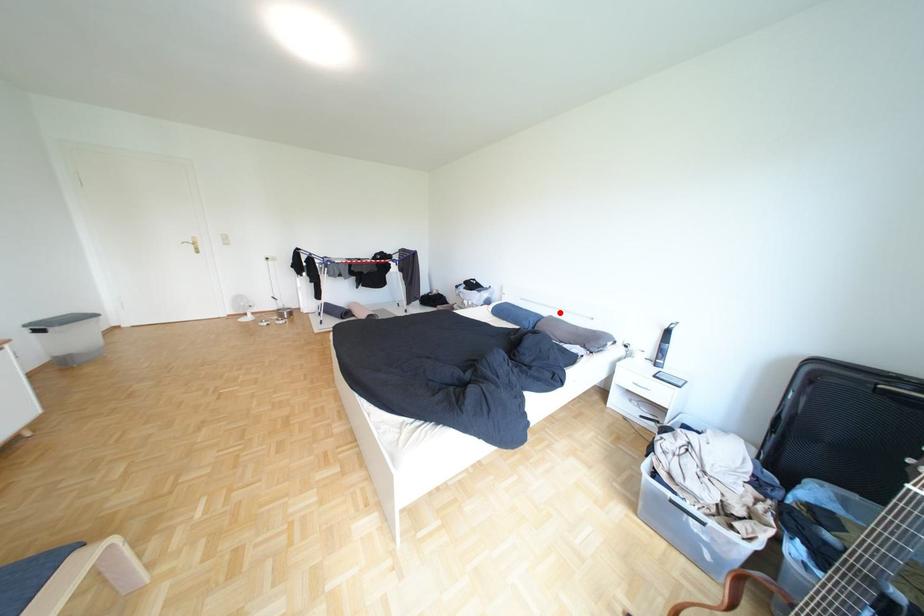
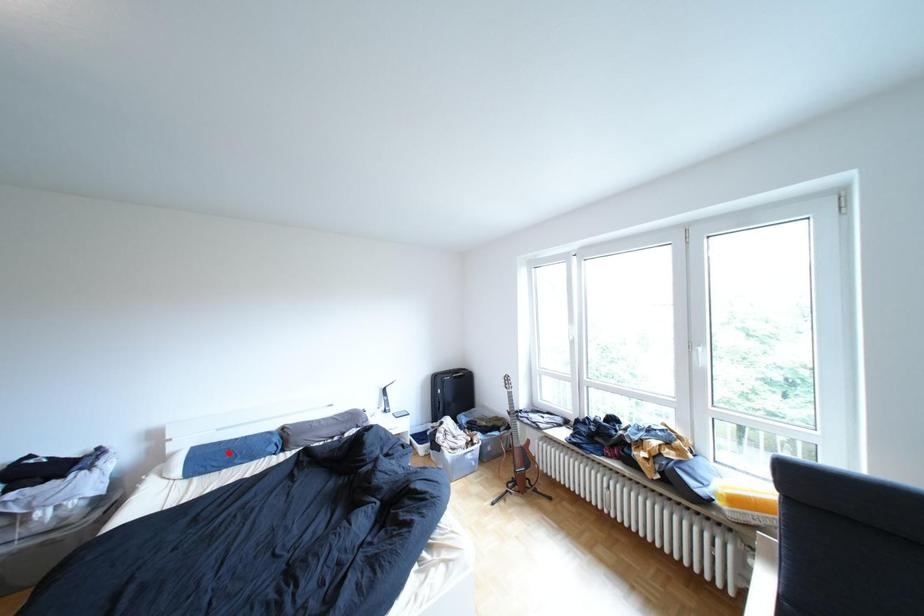
I am providing you with two images of the same scene from different viewpoints. A red point is marked on the first image and another point is marked on the second image. Are the points marked in image1 and image2 representing the same 3D position?

No